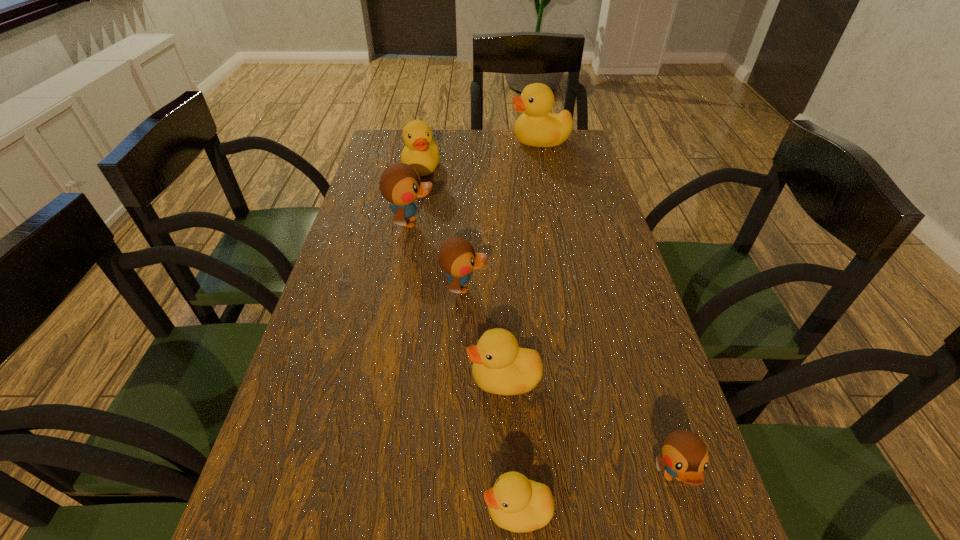
Where is `the farthest duck`? Image resolution: width=960 pixels, height=540 pixels. the farthest duck is located at coordinates (536, 127).

Find the location of a particular element. This screenshot has width=960, height=540. the farthest yellow duck is located at coordinates (536, 127).

Image resolution: width=960 pixels, height=540 pixels. I want to click on the third farthest object, so click(400, 184).

Locate an element on the screen. the fifth nearest duck is located at coordinates click(400, 184).

At what (x,y) coordinates should I click in order to perform the action: click on the sixth nearest duck. Please return your answer as a coordinate pair (x, y). The height and width of the screenshot is (540, 960). Looking at the image, I should click on 421,152.

The height and width of the screenshot is (540, 960). I want to click on the second farthest yellow duck, so click(x=421, y=152).

What are the coordinates of `the second blue duck from left to right` in the screenshot? It's located at (457, 257).

Identify the location of the fourth farthest object. This screenshot has height=540, width=960. (457, 257).

Locate an element on the screen. The image size is (960, 540). the second smallest yellow duck is located at coordinates (500, 366).

Where is `the fifth farthest duck`? the fifth farthest duck is located at coordinates point(500,366).